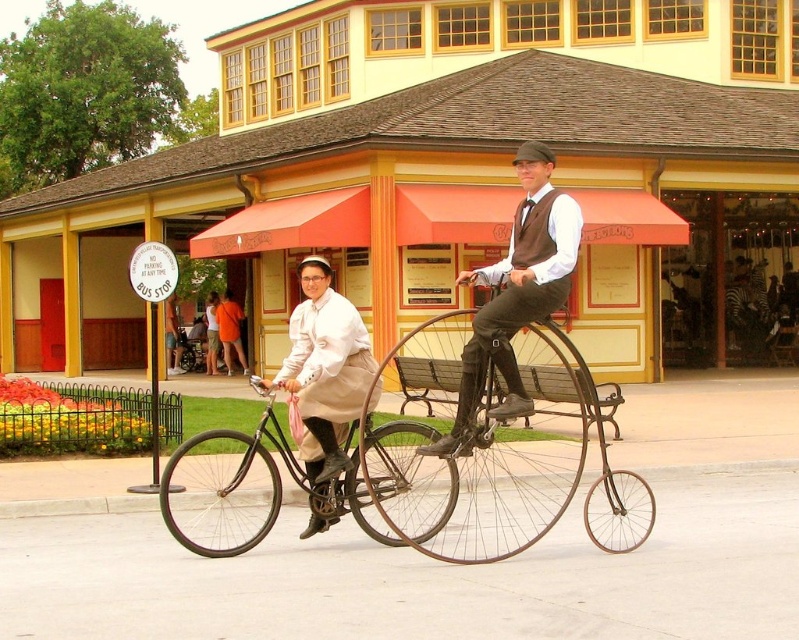
Question: Which of the following is the closest to the observer?

Choices:
 (A) (205, 372)
 (B) (213, 356)

Answer: (B)

Question: Is matte white dress at center in front of orange cotton dress at center?

Choices:
 (A) no
 (B) yes

Answer: (B)

Question: Which point appears farthest from the camera in this image?

Choices:
 (A) (215, 300)
 (B) (519, 150)
 (C) (406, 468)

Answer: (A)

Question: Which point is farther to the camera?

Choices:
 (A) (209, 339)
 (B) (245, 516)
 (C) (233, 304)

Answer: (A)

Question: Does black matte bicycle at center appear on the right side of orange cotton dress at center?

Choices:
 (A) yes
 (B) no

Answer: (A)

Question: In this image, where is orange cotton dress at center located relative to orange fabric dress at center?

Choices:
 (A) above
 (B) below

Answer: (B)